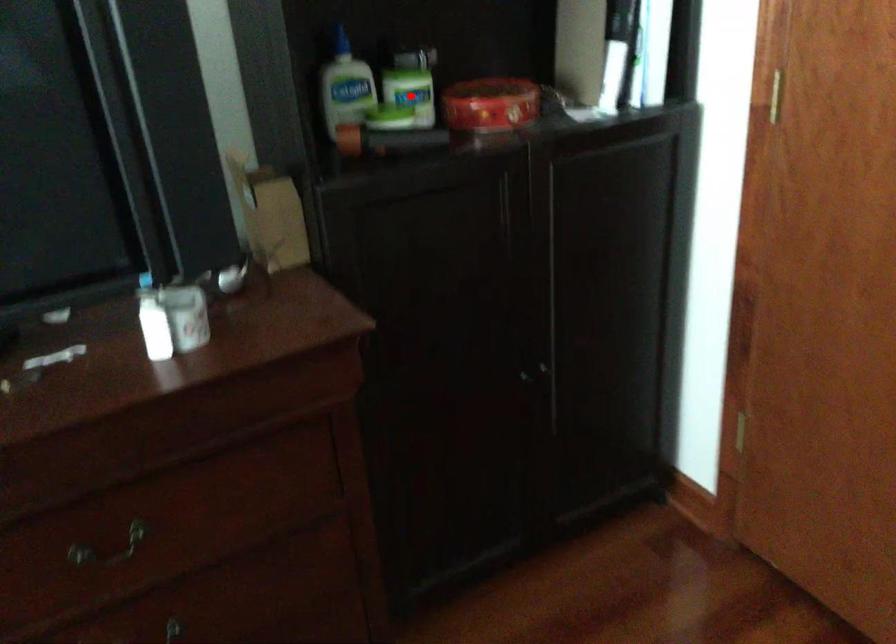
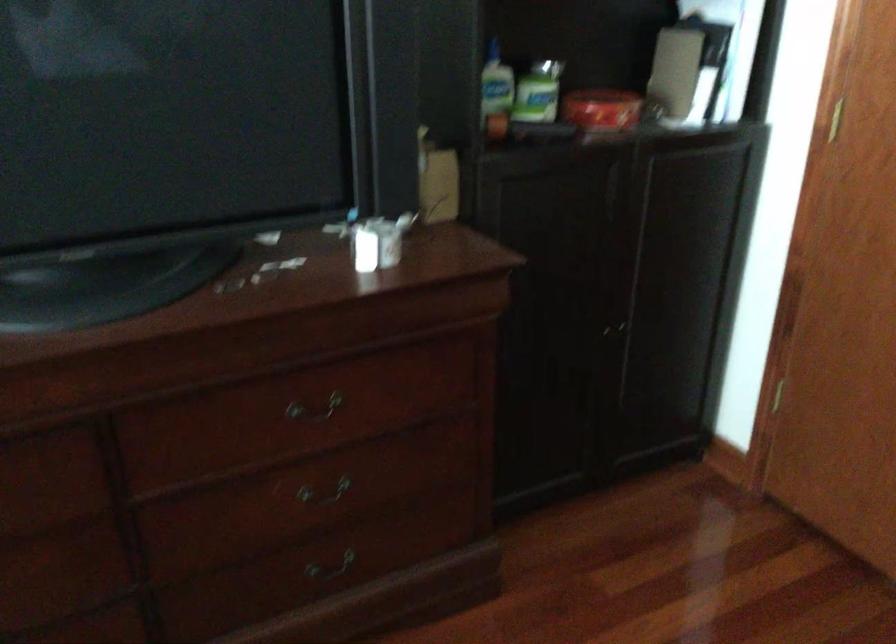
The point at the highlighted location is marked in the first image. Where is the corresponding point in the second image?

(538, 91)